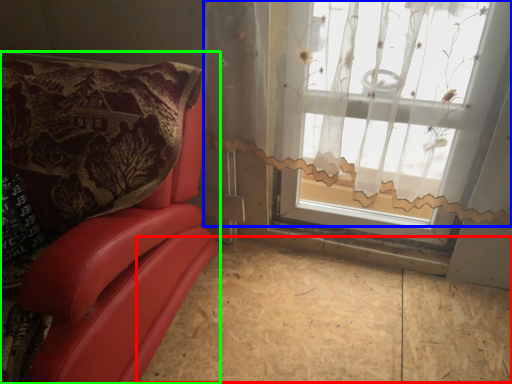
Question: Which object is positioned farthest from plywood (highlighted by a red box)? Select from curtain (highlighted by a blue box) and furniture (highlighted by a green box).

Choices:
 (A) curtain
 (B) furniture

Answer: (A)